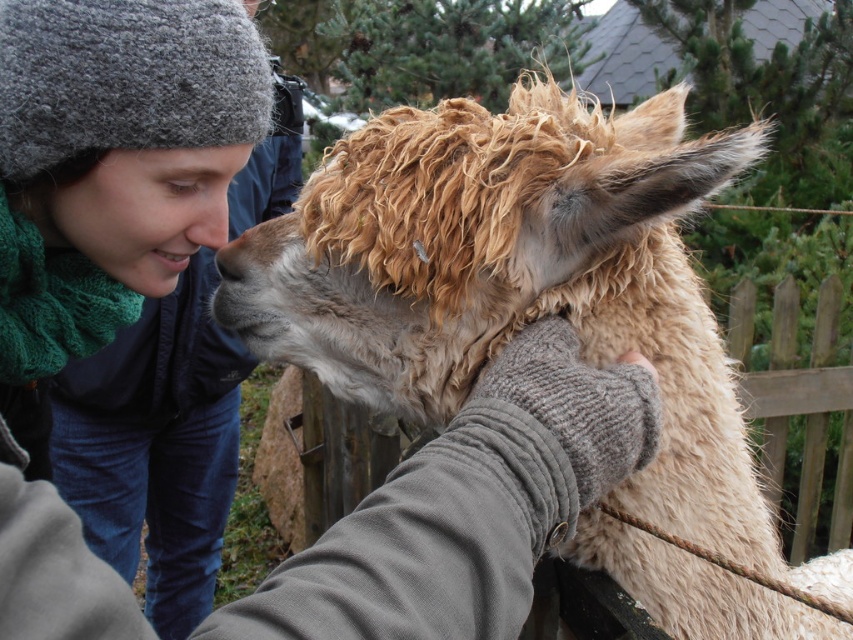
You are standing in a field with the fuzzy beige alpaca at center and the brown woolen nose at center. If you want to pet the alpaca, which part should you reach for first?

You should reach for the fuzzy beige alpaca at center first because it is closer to you than the brown woolen nose at center.

Looking at this image, you are holding a small treat in your hand and want to give it to the fuzzy beige alpaca at center. The matte skin nose at center is currently facing away from you. Which direction should you move the treat to so the alpaca can reach it?

Since the fuzzy beige alpaca at center might be wider than the matte skin nose at center, you should move the treat towards the side of the alpaca opposite to where the nose is facing to encourage the alpaca to turn its head toward you.

Looking at the scene where a person interacts with an alpaca, you notice two noses at the center of the image. The person has a matte skin nose at center, and the alpaca has a brown woolen nose at center. Which nose is positioned to the left?

The matte skin nose at center is positioned to the left of the brown woolen nose at center.